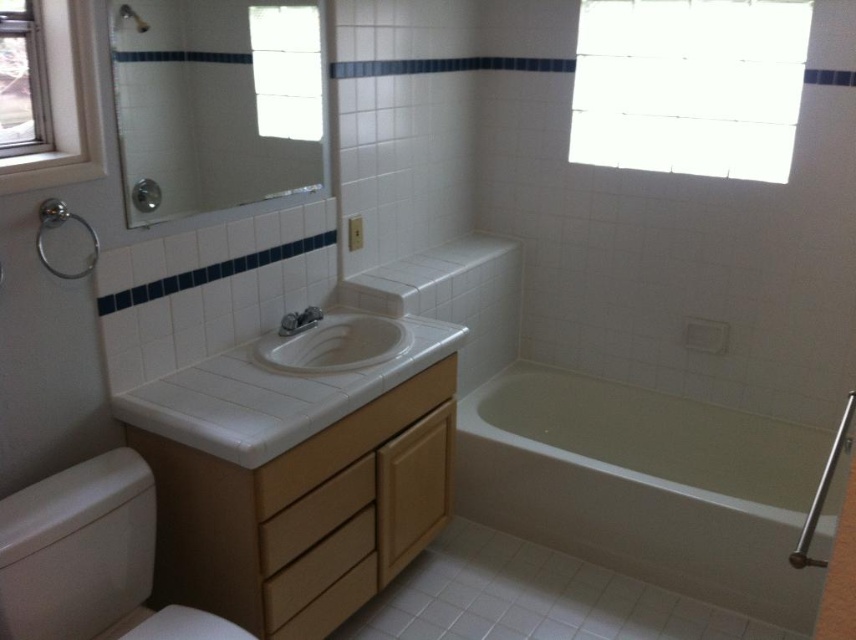
Question: Is clear glass window at upper left to the left of matte silver faucet at center from the viewer's perspective?

Choices:
 (A) yes
 (B) no

Answer: (A)

Question: Does white glossy bathtub at lower right have a lesser width compared to wooden drawer at center?

Choices:
 (A) yes
 (B) no

Answer: (B)

Question: Which point is farther from the camera taking this photo?

Choices:
 (A) (311, 317)
 (B) (34, 12)
 (C) (144, 605)

Answer: (A)

Question: Which point is closer to the camera?

Choices:
 (A) wooden drawer at center
 (B) white plastic window at upper left

Answer: (B)

Question: Which point appears closest to the camera in this image?

Choices:
 (A) (759, 129)
 (B) (70, 131)
 (C) (9, 19)
 (D) (655, 408)

Answer: (C)

Question: Considering the relative positions of white glossy bathtub at lower right and transparent glass window at upper right in the image provided, where is white glossy bathtub at lower right located with respect to transparent glass window at upper right?

Choices:
 (A) right
 (B) left

Answer: (B)